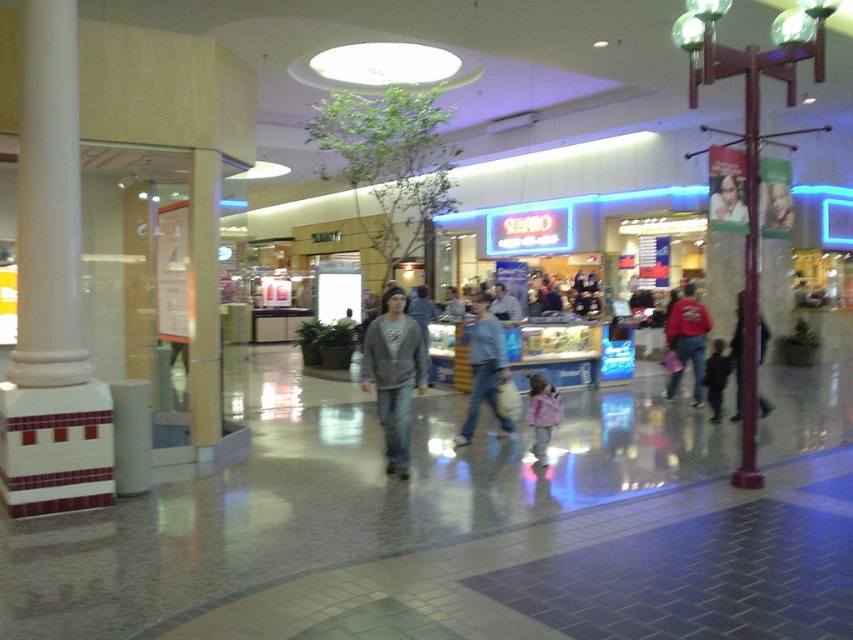
Who is higher up, dark gray hoodie at center or dark blue jeans at center?

dark blue jeans at center

Between point (733, 340) and point (715, 358), which one is positioned behind?

The point (733, 340) is more distant.

Identify the location of dark gray hoodie at center. (737, 353).

What do you see at coordinates (485, 368) in the screenshot?
I see `light blue denim jeans at center` at bounding box center [485, 368].

Who is more forward, (x=500, y=426) or (x=706, y=397)?

Positioned in front is point (x=500, y=426).

Image resolution: width=853 pixels, height=640 pixels. What are the coordinates of `light blue denim jeans at center` in the screenshot? It's located at tap(485, 368).

Can you confirm if smooth plastic face at center is thinner than dark gray hoodie at center?

Incorrect, smooth plastic face at center's width is not less than dark gray hoodie at center's.

What do you see at coordinates (776, 208) in the screenshot?
I see `smooth plastic face at center` at bounding box center [776, 208].

The image size is (853, 640). In order to click on smooth plastic face at center in this screenshot , I will do `click(776, 208)`.